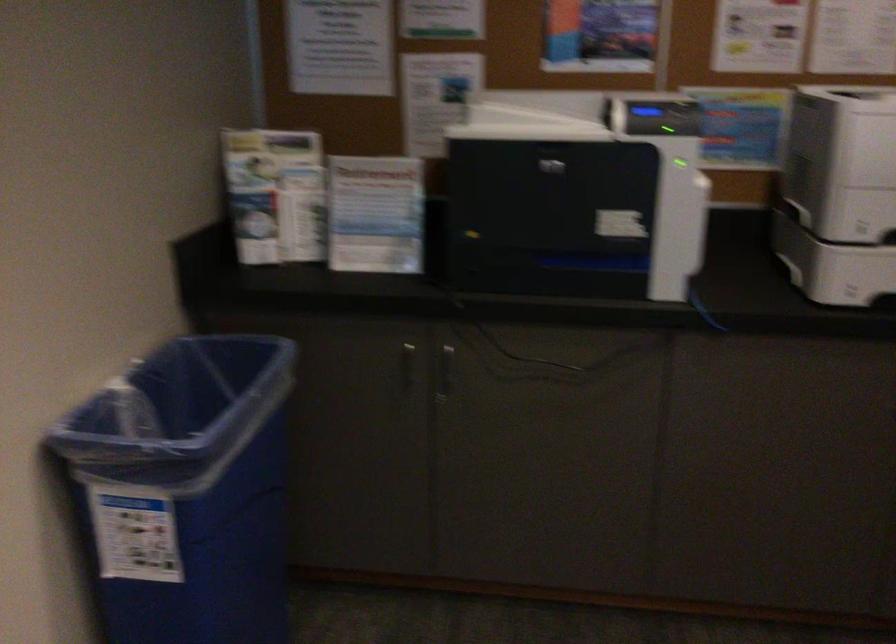
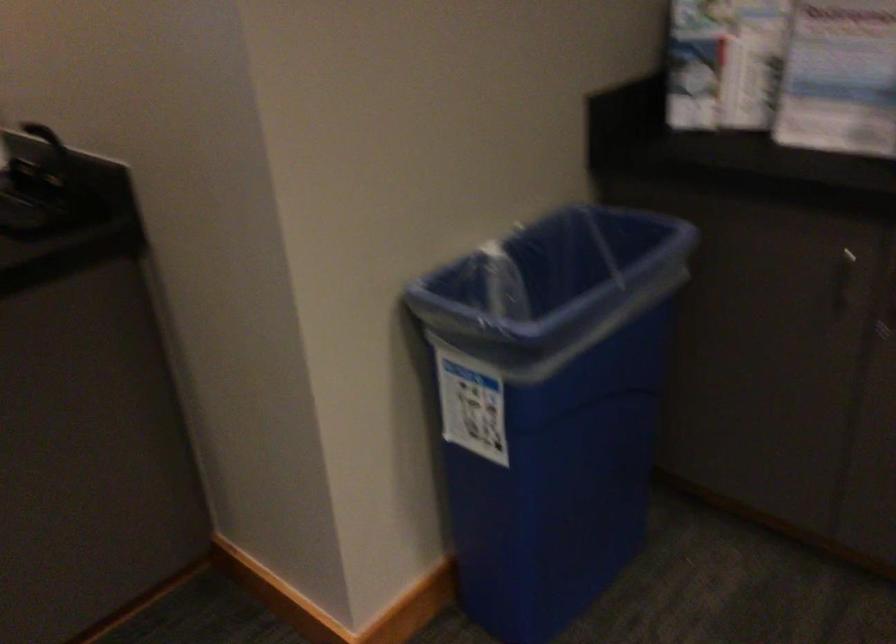
In the second image, find the point that corresponds to point (412, 366) in the first image.

(842, 279)